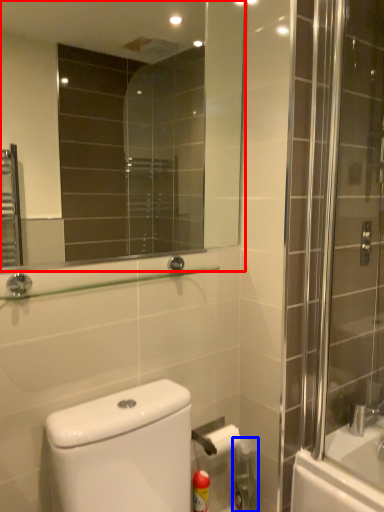
Question: Which of the following is the closest to the observer, mirror (highlighted by a red box) or cleaning product (highlighted by a blue box)?

Choices:
 (A) mirror
 (B) cleaning product

Answer: (A)